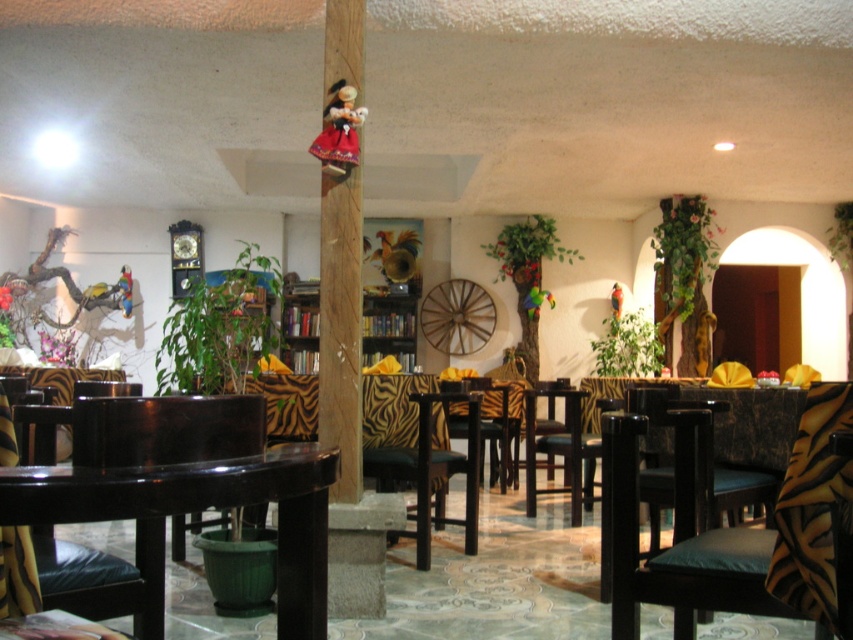
From the picture: You are standing in the rustic restaurant and want to place a small potted plant between the two points marked as point (70, 470) and point (618, 515). Which point should the plant be closer to in order to be nearer to the viewer?

The plant should be placed closer to point (70, 470) because it is closer to the viewer than point (618, 515).